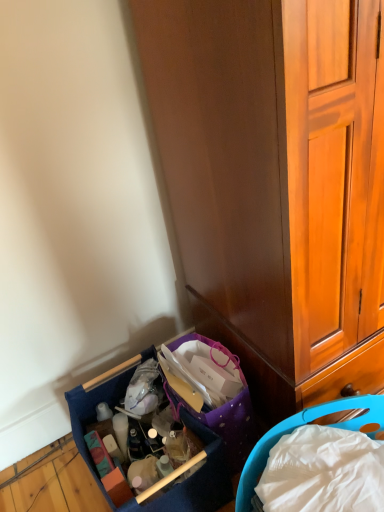
Question: Is wooden cabinet at lower right far away from blue fabric basket at lower left, the 1th picnic basket positioned from the left?

Choices:
 (A) no
 (B) yes

Answer: (A)

Question: From a real-world perspective, is wooden cabinet at lower right physically above blue fabric basket at lower left, the 1th picnic basket positioned from the left?

Choices:
 (A) no
 (B) yes

Answer: (B)

Question: Is wooden cabinet at lower right in contact with blue fabric basket at lower left, the second picnic basket positioned from the right?

Choices:
 (A) yes
 (B) no

Answer: (B)

Question: Considering the relative sizes of wooden cabinet at lower right and blue fabric basket at lower left, the 1th picnic basket positioned from the left, in the image provided, is wooden cabinet at lower right shorter than blue fabric basket at lower left, the 1th picnic basket positioned from the left,?

Choices:
 (A) no
 (B) yes

Answer: (A)

Question: Considering the relative sizes of wooden cabinet at lower right and blue fabric basket at lower left, the 1th picnic basket positioned from the left, in the image provided, is wooden cabinet at lower right taller than blue fabric basket at lower left, the 1th picnic basket positioned from the left,?

Choices:
 (A) no
 (B) yes

Answer: (B)

Question: Which is correct: blue plastic picnic basket at lower right, which is counted as the 1th picnic basket, starting from the right, is inside blue fabric basket at lower left, the 1th picnic basket positioned from the left, or outside of it?

Choices:
 (A) inside
 (B) outside

Answer: (B)

Question: Based on their sizes in the image, would you say blue plastic picnic basket at lower right, which is counted as the 1th picnic basket, starting from the right, is bigger or smaller than blue fabric basket at lower left, the second picnic basket positioned from the right?

Choices:
 (A) big
 (B) small

Answer: (B)

Question: From a real-world perspective, is blue plastic picnic basket at lower right, which is counted as the 1th picnic basket, starting from the right, above or below blue fabric basket at lower left, the second picnic basket positioned from the right?

Choices:
 (A) above
 (B) below

Answer: (B)

Question: From the image's perspective, is blue plastic picnic basket at lower right, which is counted as the second picnic basket, starting from the left, located above or below blue fabric basket at lower left, the second picnic basket positioned from the right?

Choices:
 (A) above
 (B) below

Answer: (B)

Question: In terms of width, does blue fabric basket at lower left, the 1th picnic basket positioned from the left, look wider or thinner when compared to blue plastic picnic basket at lower right, which is counted as the second picnic basket, starting from the left?

Choices:
 (A) thin
 (B) wide

Answer: (B)

Question: Considering the relative positions of blue fabric basket at lower left, the 1th picnic basket positioned from the left, and blue plastic picnic basket at lower right, which is counted as the 1th picnic basket, starting from the right, in the image provided, is blue fabric basket at lower left, the 1th picnic basket positioned from the left, to the left or to the right of blue plastic picnic basket at lower right, which is counted as the 1th picnic basket, starting from the right,?

Choices:
 (A) right
 (B) left

Answer: (B)

Question: Is blue fabric basket at lower left, the second picnic basket positioned from the right, in front of or behind blue plastic picnic basket at lower right, which is counted as the 1th picnic basket, starting from the right, in the image?

Choices:
 (A) behind
 (B) front

Answer: (A)

Question: From a real-world perspective, is blue fabric basket at lower left, the second picnic basket positioned from the right, above or below blue plastic picnic basket at lower right, which is counted as the second picnic basket, starting from the left?

Choices:
 (A) below
 (B) above

Answer: (B)

Question: Is blue fabric basket at lower left, the 1th picnic basket positioned from the left, bigger or smaller than wooden cabinet at lower right?

Choices:
 (A) big
 (B) small

Answer: (B)

Question: In the image, is blue fabric basket at lower left, the second picnic basket positioned from the right, positioned in front of or behind wooden cabinet at lower right?

Choices:
 (A) behind
 (B) front

Answer: (A)